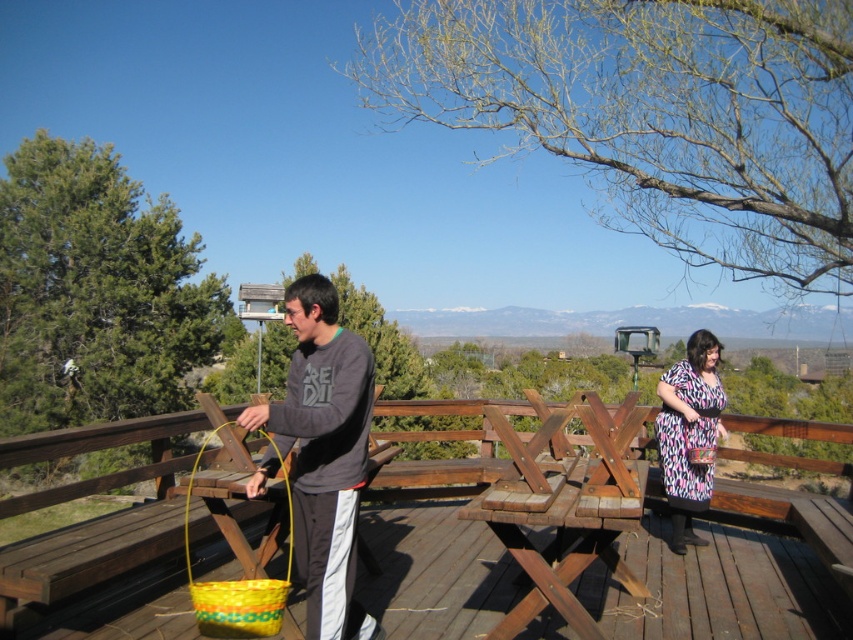
Question: Can you confirm if matte yellow basket at center is wider than printed fabric dress at right?

Choices:
 (A) yes
 (B) no

Answer: (B)

Question: Which object appears farthest from the camera in this image?

Choices:
 (A) matte yellow basket at center
 (B) wooden picnic table at center

Answer: (B)

Question: Is wooden picnic table at center thinner than printed fabric dress at right?

Choices:
 (A) yes
 (B) no

Answer: (B)

Question: Does matte yellow basket at center have a lesser width compared to printed fabric dress at right?

Choices:
 (A) no
 (B) yes

Answer: (B)

Question: Which point appears farthest from the camera in this image?

Choices:
 (A) (666, 618)
 (B) (370, 403)
 (C) (659, 417)

Answer: (C)

Question: Which point is farther to the camera?

Choices:
 (A) (699, 508)
 (B) (343, 465)

Answer: (A)